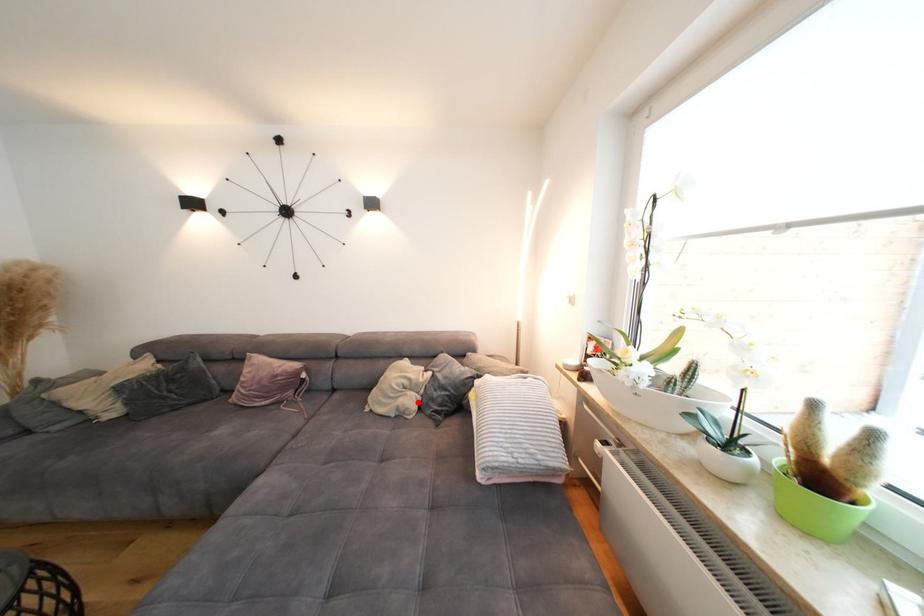
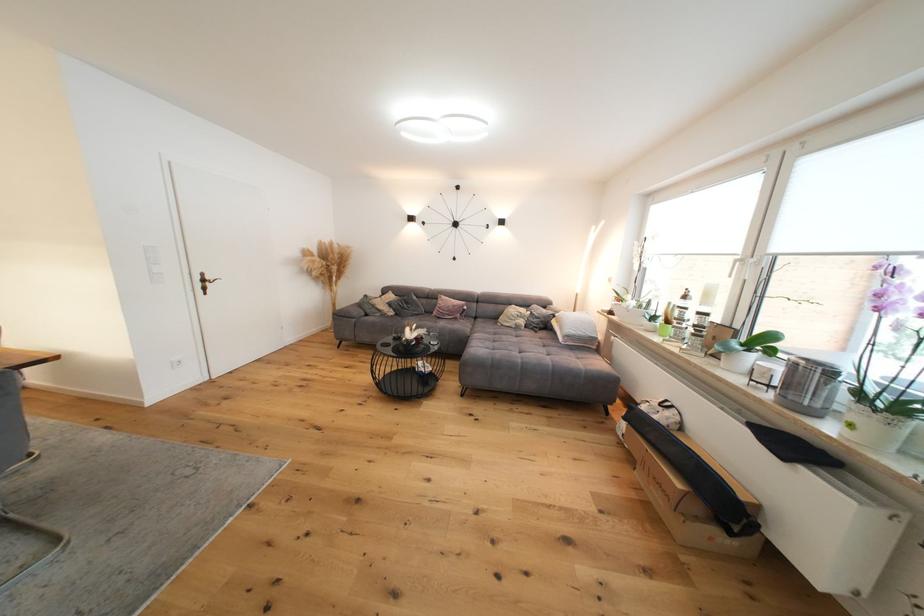
Question: I am providing you with two images of the same scene from different viewpoints. A red point is marked on the first image. At the location where the point appears in image 1, is it still visible in image 2?

Choices:
 (A) Yes
 (B) No

Answer: (A)